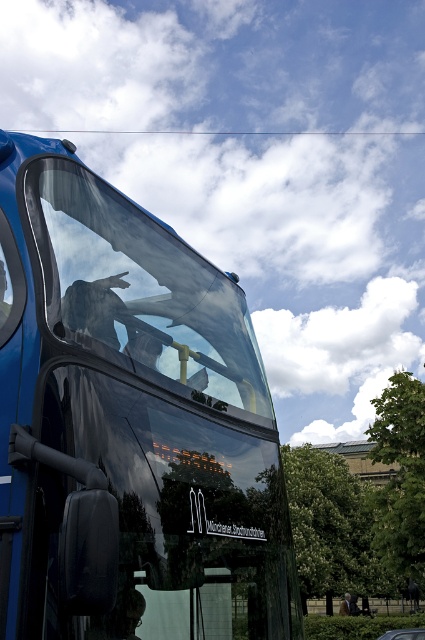
You are a passenger on the shiny blue bus at center and want to know where you are sitting. The driver says you are sitting at point (129, 424). Based on the scene description, can you determine if you are sitting inside the bus or outside?

The point (129, 424) marks the shiny blue bus at center, so you are sitting inside the bus.